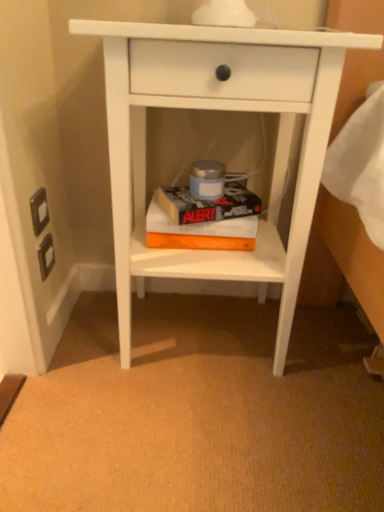
Question: Can you confirm if white matte nightstand at center is positioned to the left of orange matte paperback book at center, which is the first paperback book from bottom to top?

Choices:
 (A) no
 (B) yes

Answer: (A)

Question: Is white matte nightstand at center closer to camera compared to orange matte paperback book at center, which is the 2th paperback book from top to bottom?

Choices:
 (A) no
 (B) yes

Answer: (B)

Question: Is white matte nightstand at center bigger than orange matte paperback book at center, which is the first paperback book from bottom to top?

Choices:
 (A) yes
 (B) no

Answer: (A)

Question: Is the surface of white matte nightstand at center in direct contact with orange matte paperback book at center, which is the first paperback book from bottom to top?

Choices:
 (A) no
 (B) yes

Answer: (A)

Question: Is white matte nightstand at center positioned behind orange matte paperback book at center, which is the first paperback book from bottom to top?

Choices:
 (A) yes
 (B) no

Answer: (B)

Question: From the image's perspective, is white matte nightstand at center over orange matte paperback book at center, which is the first paperback book from bottom to top?

Choices:
 (A) yes
 (B) no

Answer: (A)

Question: Is hardcover book at center, which is the 1th paperback book from top to bottom, surrounding white matte nightstand at center?

Choices:
 (A) yes
 (B) no

Answer: (B)

Question: From a real-world perspective, is hardcover book at center, the 2th paperback book ordered from the bottom, physically below white matte nightstand at center?

Choices:
 (A) yes
 (B) no

Answer: (A)

Question: Is hardcover book at center, the 2th paperback book ordered from the bottom, smaller than white matte nightstand at center?

Choices:
 (A) no
 (B) yes

Answer: (B)

Question: From the image's perspective, is hardcover book at center, which is the 1th paperback book from top to bottom, below white matte nightstand at center?

Choices:
 (A) no
 (B) yes

Answer: (A)

Question: Is hardcover book at center, which is the 1th paperback book from top to bottom, looking in the opposite direction of white matte nightstand at center?

Choices:
 (A) no
 (B) yes

Answer: (B)

Question: Does hardcover book at center, the 2th paperback book ordered from the bottom, have a greater width compared to white matte nightstand at center?

Choices:
 (A) no
 (B) yes

Answer: (A)

Question: Is hardcover book at center, the 2th paperback book ordered from the bottom, inside orange matte paperback book at center, which is the 2th paperback book from top to bottom?

Choices:
 (A) yes
 (B) no

Answer: (B)